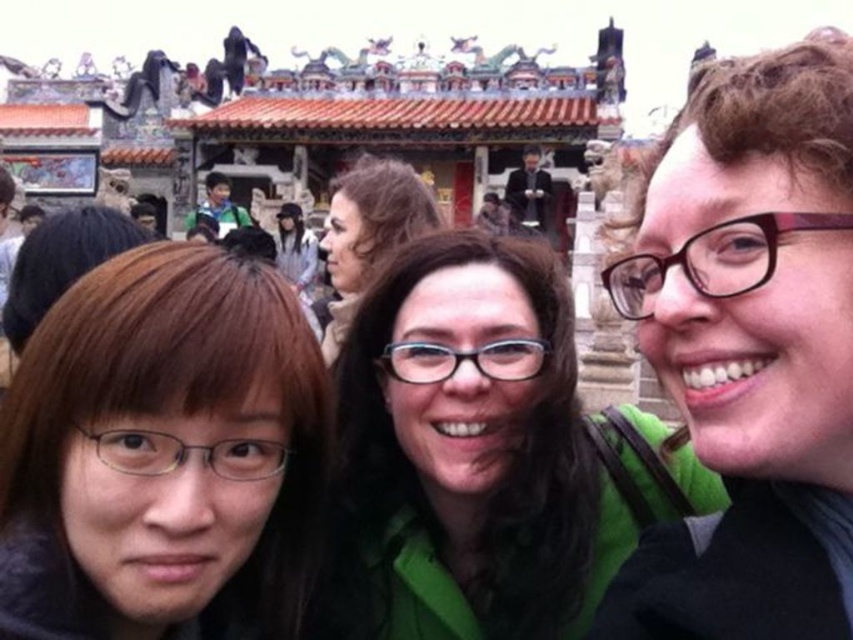
You are a photographer trying to capture the scene of three people taking a selfie in front of a traditional Chinese building. You notice the brown hair at center and the dark suit at upper center. Which object is positioned lower in the image?

The brown hair at center is positioned lower than the dark suit at upper center.

You are a photographer trying to capture a clear shot of the traditional Chinese building. You notice two people in the foreground blocking your view. The green matte shirt at center and the dark suit at upper center are in the way. Which person should you ask to move back so that the building remains mostly visible?

The green matte shirt at center is taller than the dark suit at upper center. To ensure the building remains mostly visible, you should ask the taller person, the green matte shirt at center, to move back.

You are standing in front of the traditional Chinese building and want to take a photo of the two people wearing the green matte shirt at center and the dark suit at upper center. Which one should you focus on first to ensure they are both in focus?

You should focus on the green matte shirt at center first because it is closer to the viewer than the dark suit at upper center. By focusing on the closer object, both subjects will be in focus due to the depth of field.